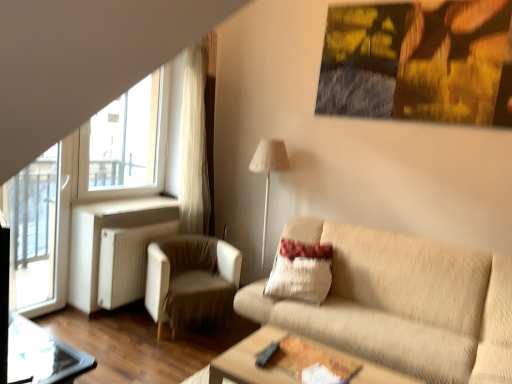
Question: In the image, is wooden table at lower center on the left side or the right side of white fabric lampshade at center?

Choices:
 (A) right
 (B) left

Answer: (A)

Question: From a real-world perspective, relative to white fabric lampshade at center, is wooden table at lower center vertically above or below?

Choices:
 (A) above
 (B) below

Answer: (B)

Question: Considering the real-world distances, which object is closest to the beige fabric couch at center?

Choices:
 (A) wooden table at lower center
 (B) white fabric lampshade at center
 (C) transparent glass screen door at left
 (D) white fabric armchair at left
 (E) beige textured pillow at center

Answer: (E)

Question: Which of these objects is positioned closest to the wooden table at lower center?

Choices:
 (A) beige fabric couch at center
 (B) transparent glass table at lower left
 (C) white fabric lampshade at center
 (D) beige textured pillow at center
 (E) white fabric armchair at left

Answer: (A)